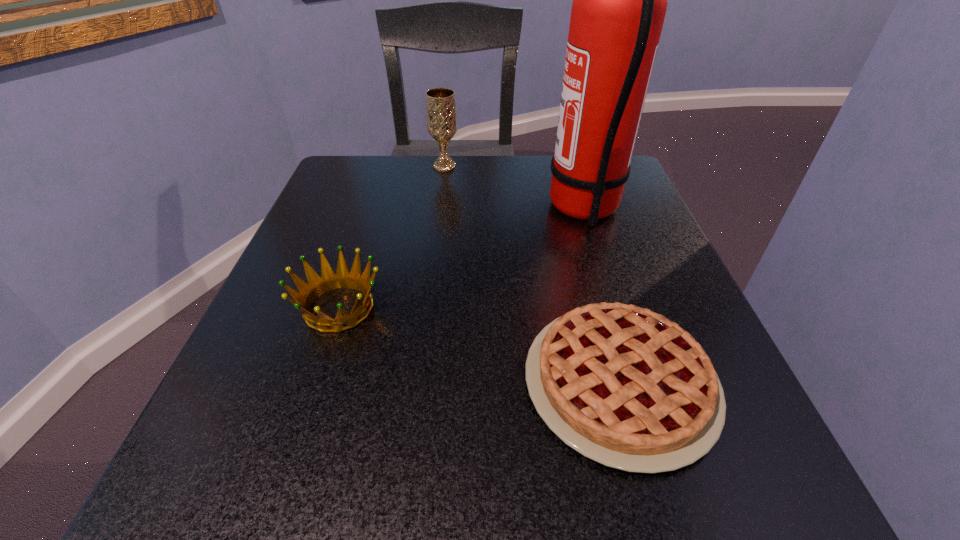
Where is `vacant space that's between the fire extinguisher and the third shortest object`? This screenshot has height=540, width=960. vacant space that's between the fire extinguisher and the third shortest object is located at coordinates (515, 188).

You are a GUI agent. You are given a task and a screenshot of the screen. Output one action in this format:
    pyautogui.click(x=<x>, y=<y>)
    Task: Click on the unoccupied area between the third nearest object and the pie
    
    Given the screenshot: What is the action you would take?
    pyautogui.click(x=602, y=296)

Image resolution: width=960 pixels, height=540 pixels. Find the location of `empty space between the crown and the third nearest object`. empty space between the crown and the third nearest object is located at coordinates (462, 258).

Image resolution: width=960 pixels, height=540 pixels. Find the location of `free space that is in between the chalice and the crown`. free space that is in between the chalice and the crown is located at coordinates 392,237.

Where is `free space between the crown and the second object from left to right`? This screenshot has height=540, width=960. free space between the crown and the second object from left to right is located at coordinates (392, 237).

Locate an element on the screen. The height and width of the screenshot is (540, 960). vacant space in between the crown and the third shortest object is located at coordinates (392, 237).

Image resolution: width=960 pixels, height=540 pixels. Identify the location of free space between the leftmost object and the farthest object. (392, 237).

In order to click on vacant space that's between the fire extinguisher and the second tallest object in this screenshot , I will do point(515,188).

Choose which object is the nearest neighbor to the pie. Please provide its 2D coordinates. Your answer should be formatted as a tuple, i.e. [(x, y)], where the tuple contains the x and y coordinates of a point satisfying the conditions above.

[(619, 5)]

Identify the location of object that can be found as the third closest to the tallest object. (329, 280).